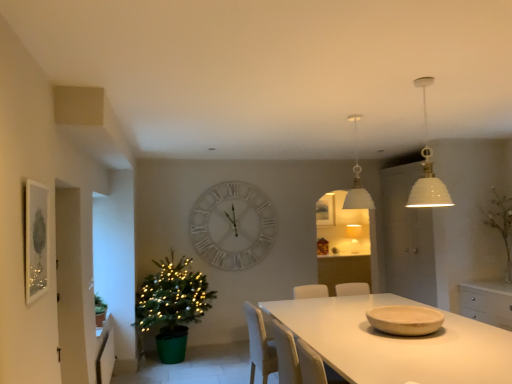
The image size is (512, 384). What do you see at coordinates (426, 169) in the screenshot?
I see `white ceramic lampshade at upper right, which is the first lamp from front to back` at bounding box center [426, 169].

What do you see at coordinates (173, 305) in the screenshot? I see `green matte christmas tree at lower left` at bounding box center [173, 305].

In order to face matte beige bowl at table right, should I rotate leftwards or rightwards?

Turn right by 19.088 degrees to look at matte beige bowl at table right.

The width and height of the screenshot is (512, 384). I want to click on white matte pendant light at upper center, acting as the first lamp starting from the back, so click(357, 180).

From a real-world perspective, who is located lower, white ceramic lampshade at upper right, the 2th lamp when ordered from back to front, or white matte table at center?

From a 3D spatial view, white matte table at center is below.

Is white ceramic lampshade at upper right, which is the first lamp from front to back, aimed at white matte table at center?

No, white ceramic lampshade at upper right, which is the first lamp from front to back, is not facing towards white matte table at center.

From the image's perspective, who appears lower, white ceramic lampshade at upper right, which is the first lamp from front to back, or white matte table at center?

white matte table at center.

Does white ceramic lampshade at upper right, which is the first lamp from front to back, have a lesser height compared to white matte table at center?

Indeed, white ceramic lampshade at upper right, which is the first lamp from front to back, has a lesser height compared to white matte table at center.

Is matte white picture frame at center, arranged as the second picture frame when viewed from the left, bigger than white matte pendant light at upper center, acting as the second lamp starting from the front?

No, matte white picture frame at center, arranged as the second picture frame when viewed from the left, is not bigger than white matte pendant light at upper center, acting as the second lamp starting from the front.

Who is more distant, matte white picture frame at center, arranged as the second picture frame when viewed from the left, or white matte pendant light at upper center, acting as the first lamp starting from the back?

matte white picture frame at center, arranged as the second picture frame when viewed from the left, is further away from the camera.

Looking at this image, is white matte pendant light at upper center, acting as the second lamp starting from the front, surrounded by matte white picture frame at center, arranged as the second picture frame when viewed from the left?

No, white matte pendant light at upper center, acting as the second lamp starting from the front, is not a part of matte white picture frame at center, arranged as the second picture frame when viewed from the left.

Is white matte clock at center completely or partially inside white matte pendant light at upper center, acting as the second lamp starting from the front?

No, white matte clock at center is not inside white matte pendant light at upper center, acting as the second lamp starting from the front.

Can you tell me how much white matte pendant light at upper center, acting as the second lamp starting from the front, and white matte clock at center differ in facing direction?

5.88 degrees separate the facing orientations of white matte pendant light at upper center, acting as the second lamp starting from the front, and white matte clock at center.

Considering the sizes of objects white matte pendant light at upper center, acting as the first lamp starting from the back, and white matte clock at center in the image provided, who is bigger, white matte pendant light at upper center, acting as the first lamp starting from the back, or white matte clock at center?

white matte clock at center is bigger.

Can you confirm if white matte pendant light at upper center, acting as the first lamp starting from the back, is thinner than white matte clock at center?

In fact, white matte pendant light at upper center, acting as the first lamp starting from the back, might be wider than white matte clock at center.

Which point is more distant from viewer, (104, 303) or (225, 207)?

The point (225, 207) is behind.

Consider the image. Which object is closer to the camera, green matte plant at left, which is the first plant from front to back, or white matte clock at center?

green matte plant at left, which is the first plant from front to back.

In the scene shown: Considering the relative positions of green matte plant at left, the second plant in the back-to-front sequence, and white matte clock at center in the image provided, is green matte plant at left, the second plant in the back-to-front sequence, to the right of white matte clock at center from the viewer's perspective?

No, green matte plant at left, the second plant in the back-to-front sequence, is not to the right of white matte clock at center.

From the image's perspective, between green matte plant at left, the 2th plant positioned from the right, and white matte clock at center, which one is located above?

white matte clock at center is shown above in the image.

The image size is (512, 384). I want to click on bowl that appears on the right of matte silver picture frame at left, which is the 2th picture frame from right to left, so click(405, 320).

Which object is positioned more to the left, matte silver picture frame at left, which is the first picture frame in left-to-right order, or matte beige bowl at table right?

From the viewer's perspective, matte silver picture frame at left, which is the first picture frame in left-to-right order, appears more on the left side.

Is matte silver picture frame at left, which is the 2th picture frame from right to left, situated inside matte beige bowl at table right or outside?

matte silver picture frame at left, which is the 2th picture frame from right to left, is not inside matte beige bowl at table right, it's outside.

Is matte silver picture frame at left, which is the second picture frame in back-to-front order, facing away from matte beige bowl at table right?

No, matte beige bowl at table right is not at the back of matte silver picture frame at left, which is the second picture frame in back-to-front order.

The height and width of the screenshot is (384, 512). I want to click on bowl below the white matte pendant light at upper center, acting as the first lamp starting from the back (from a real-world perspective), so click(x=405, y=320).

Can you confirm if matte beige bowl at table right is wider than white matte pendant light at upper center, acting as the second lamp starting from the front?

Indeed, matte beige bowl at table right has a greater width compared to white matte pendant light at upper center, acting as the second lamp starting from the front.

Can you confirm if matte beige bowl at table right is smaller than white matte pendant light at upper center, acting as the first lamp starting from the back?

Yes.

Is point (404, 305) closer to camera compared to point (357, 161)?

Yes, point (404, 305) is closer to viewer.

Based on their sizes in the image, would you say white textured vase at upper right, the first plant viewed from the top, is bigger or smaller than green matte plant at left, the 1th plant ordered from the bottom?

Considering their sizes, white textured vase at upper right, the first plant viewed from the top, takes up more space than green matte plant at left, the 1th plant ordered from the bottom.

Does white textured vase at upper right, placed as the second plant when sorted from bottom to top, touch green matte plant at left, which is the 1th plant from left to right?

There is a gap between white textured vase at upper right, placed as the second plant when sorted from bottom to top, and green matte plant at left, which is the 1th plant from left to right.

Could you tell me if white textured vase at upper right, positioned as the first plant in back-to-front order, is turned towards green matte plant at left, the 2th plant positioned from the right?

No, white textured vase at upper right, positioned as the first plant in back-to-front order, is not oriented towards green matte plant at left, the 2th plant positioned from the right.

Relative to green matte plant at left, which is the first plant from front to back, is white textured vase at upper right, which is the 2th plant from front to back, in front or behind?

Visually, white textured vase at upper right, which is the 2th plant from front to back, is located behind green matte plant at left, which is the first plant from front to back.

In order to click on table that appears in front of the white ceramic lampshade at upper right, which is the first lamp from front to back in this screenshot , I will do `click(396, 343)`.

Identify the location of lamp that is the 1st object located above the matte white picture frame at center, which appears as the 1th picture frame when viewed from the back (from the image's perspective). This screenshot has width=512, height=384. 357,180.

Based on their spatial positions, is white matte table at center or green matte christmas tree at lower left further from white ceramic lampshade at upper right, the 2th lamp when ordered from back to front?

green matte christmas tree at lower left is positioned further to the anchor white ceramic lampshade at upper right, the 2th lamp when ordered from back to front.

Based on their spatial positions, is green matte plant at left, the second plant in the back-to-front sequence, or matte beige bowl at table right closer to green matte christmas tree at lower left?

green matte plant at left, the second plant in the back-to-front sequence, is positioned closer to the anchor green matte christmas tree at lower left.

Based on their spatial positions, is white textured vase at upper right, the first plant positioned from the right, or green matte christmas tree at lower left closer to white matte clock at center?

green matte christmas tree at lower left lies closer to white matte clock at center than the other object.

Which object lies further to the anchor point matte beige bowl at table right, white matte clock at center or matte silver picture frame at left, which is the first picture frame in left-to-right order?

white matte clock at center lies further to matte beige bowl at table right than the other object.

Looking at the image, which one is located closer to white matte table at center, white matte pendant light at upper center, acting as the second lamp starting from the front, or green matte plant at left, which is the 1th plant from left to right?

green matte plant at left, which is the 1th plant from left to right, is closer to white matte table at center.

Looking at the image, which one is located closer to matte silver picture frame at left, which is the second picture frame in back-to-front order, green matte christmas tree at lower left or white matte table at center?

white matte table at center lies closer to matte silver picture frame at left, which is the second picture frame in back-to-front order, than the other object.

From the image, which object appears to be farther from white ceramic lampshade at upper right, which is the first lamp from front to back, white matte table at center or white matte pendant light at upper center, acting as the first lamp starting from the back?

white matte table at center.

From the image, which object appears to be farther from green matte plant at left, the 1th plant ordered from the bottom, white matte clock at center or matte silver picture frame at left, which is the first picture frame in left-to-right order?

The object further to green matte plant at left, the 1th plant ordered from the bottom, is matte silver picture frame at left, which is the first picture frame in left-to-right order.

Locate an element on the screen. Image resolution: width=512 pixels, height=384 pixels. table located between green matte christmas tree at lower left and white textured vase at upper right, positioned as the first plant in back-to-front order, in the left-right direction is located at coordinates (396, 343).

Identify the location of bowl between white ceramic lampshade at upper right, the 2th lamp when ordered from back to front, and matte white picture frame at center, placed as the first picture frame when sorted from right to left, along the z-axis. (405, 320).

Locate an element on the screen. This screenshot has height=384, width=512. picture frame between green matte plant at left, the 2th plant from the top, and white ceramic lampshade at upper right, which is the first lamp from front to back, from left to right is located at coordinates (36, 240).

Where is `lamp located between green matte christmas tree at lower left and white ceramic lampshade at upper right, the 2th lamp when ordered from back to front, in the left-right direction`? The height and width of the screenshot is (384, 512). lamp located between green matte christmas tree at lower left and white ceramic lampshade at upper right, the 2th lamp when ordered from back to front, in the left-right direction is located at coordinates (357, 180).